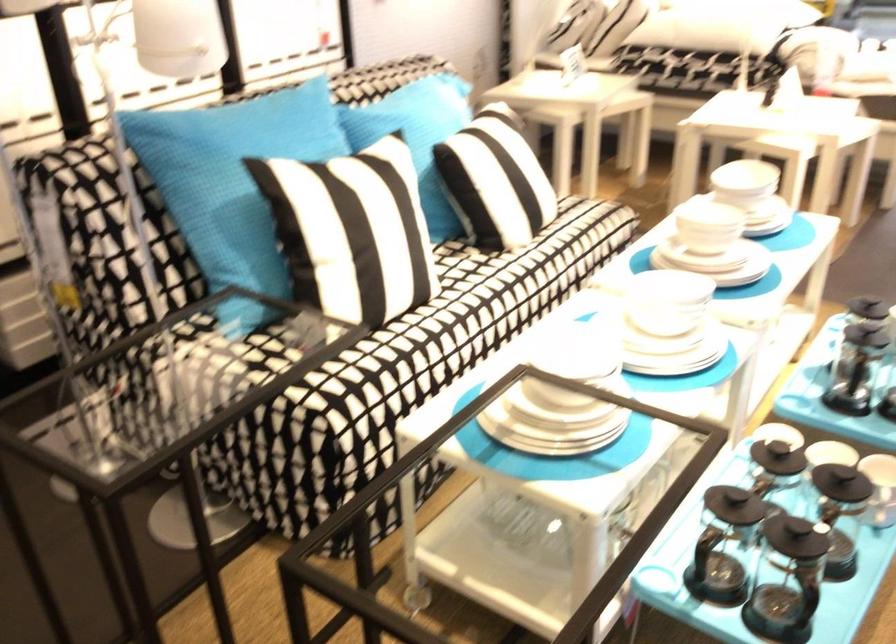
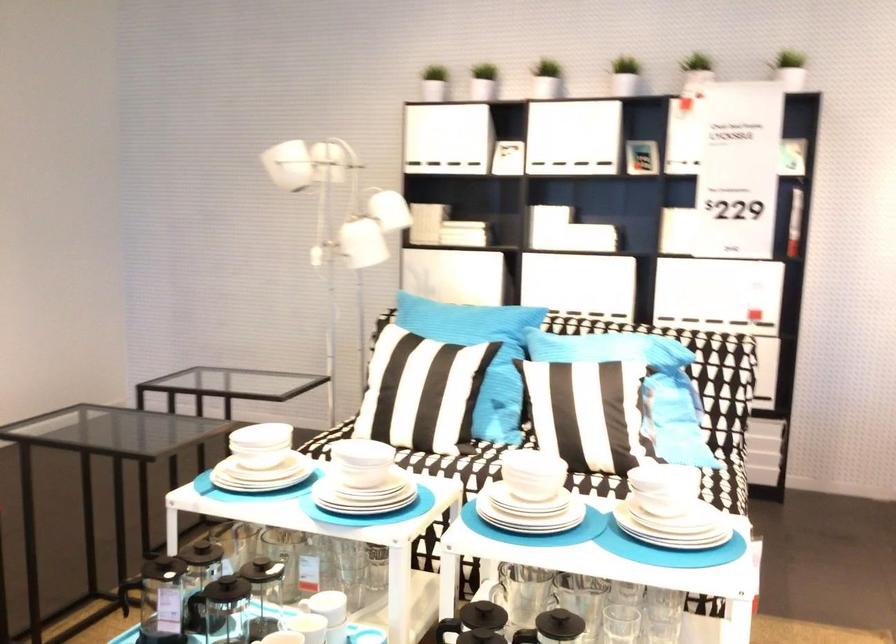
Where in the second image is the point corresponding to pixel 536 375 from the first image?

(261, 440)